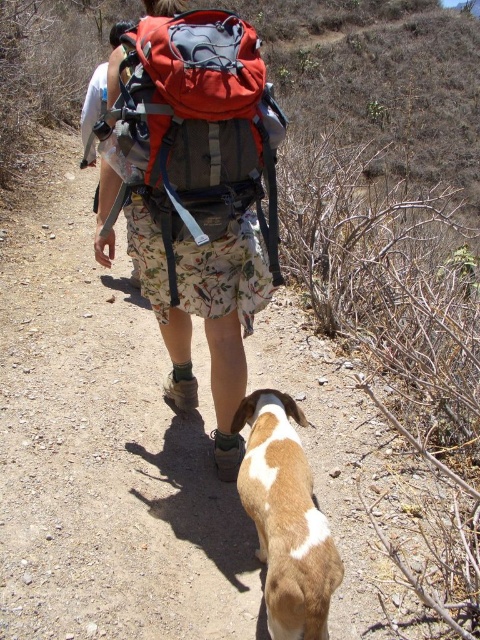
Can you confirm if matte red backpack at center is taller than brown and white fur at lower center?

Yes.

Which is behind, point (159, 100) or point (283, 516)?

The point (159, 100) is more distant.

The width and height of the screenshot is (480, 640). Find the location of `matte red backpack at center`. matte red backpack at center is located at coordinates (197, 129).

At what (x,y) coordinates should I click in order to perform the action: click on matte red backpack at center. Please return your answer as a coordinate pair (x, y). Image resolution: width=480 pixels, height=640 pixels. Looking at the image, I should click on (197, 129).